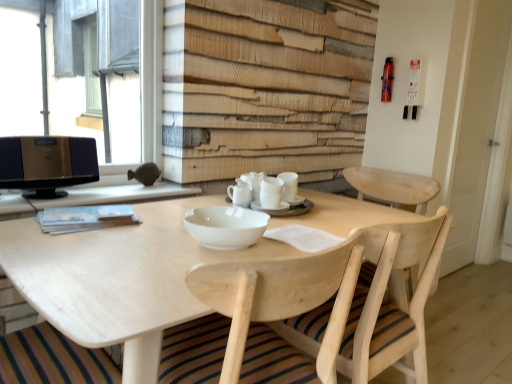
Question: Is natural wood table at center wider than white ceramic cups at center, which is the 2th tableware in left-to-right order?

Choices:
 (A) yes
 (B) no

Answer: (A)

Question: Is natural wood table at center aimed at white ceramic cups at center, placed as the 2th tableware when sorted from right to left?

Choices:
 (A) yes
 (B) no

Answer: (B)

Question: Considering the relative positions of natural wood table at center and white ceramic cups at center, placed as the 2th tableware when sorted from right to left, in the image provided, is natural wood table at center to the right of white ceramic cups at center, placed as the 2th tableware when sorted from right to left, from the viewer's perspective?

Choices:
 (A) yes
 (B) no

Answer: (B)

Question: Is natural wood table at center further to the viewer compared to white ceramic cups at center, which is the 2th tableware in left-to-right order?

Choices:
 (A) yes
 (B) no

Answer: (B)

Question: Does natural wood table at center have a lesser width compared to white ceramic cups at center, which is the 2th tableware in left-to-right order?

Choices:
 (A) yes
 (B) no

Answer: (B)

Question: Do you think light wood chair at center is within white wooden door at right, or outside of it?

Choices:
 (A) outside
 (B) inside

Answer: (A)

Question: From the image's perspective, is light wood chair at center above or below white wooden door at right?

Choices:
 (A) above
 (B) below

Answer: (B)

Question: From a real-world perspective, is light wood chair at center positioned above or below white wooden door at right?

Choices:
 (A) above
 (B) below

Answer: (B)

Question: Is light wood chair at center to the left or to the right of white wooden door at right in the image?

Choices:
 (A) left
 (B) right

Answer: (A)

Question: From the image's perspective, is white matte paper at left above or below natural wood table at center?

Choices:
 (A) below
 (B) above

Answer: (B)

Question: Is white matte paper at left inside or outside of natural wood table at center?

Choices:
 (A) inside
 (B) outside

Answer: (B)

Question: From a real-world perspective, is white matte paper at left positioned above or below natural wood table at center?

Choices:
 (A) below
 (B) above

Answer: (B)

Question: Looking at the image, does white matte paper at left seem bigger or smaller compared to natural wood table at center?

Choices:
 (A) small
 (B) big

Answer: (A)

Question: Considering their positions, is natural wood table at center located in front of or behind white matte cups at center, arranged as the first tableware when viewed from the right?

Choices:
 (A) front
 (B) behind

Answer: (A)

Question: Is natural wood table at center spatially inside white matte cups at center, the third tableware positioned from the left, or outside of it?

Choices:
 (A) outside
 (B) inside

Answer: (A)